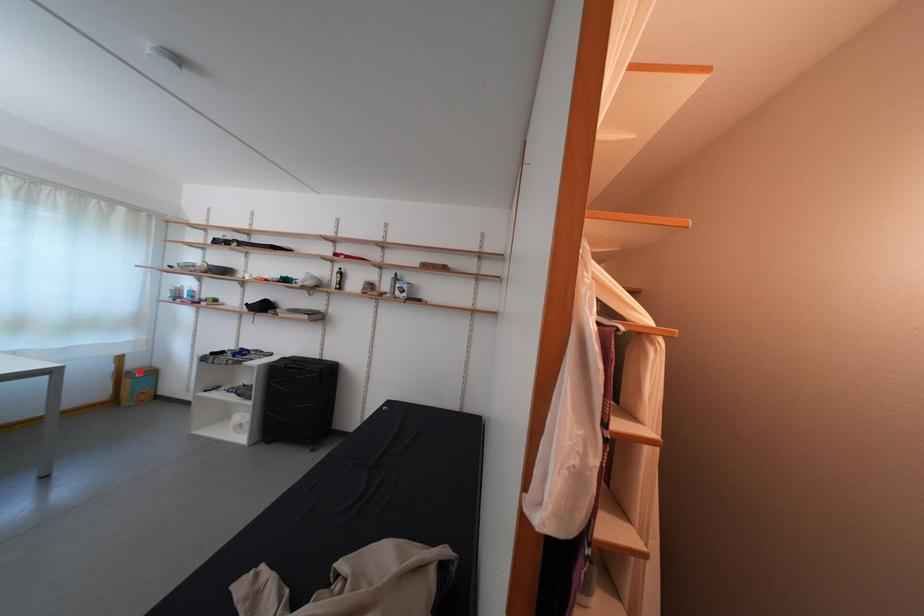
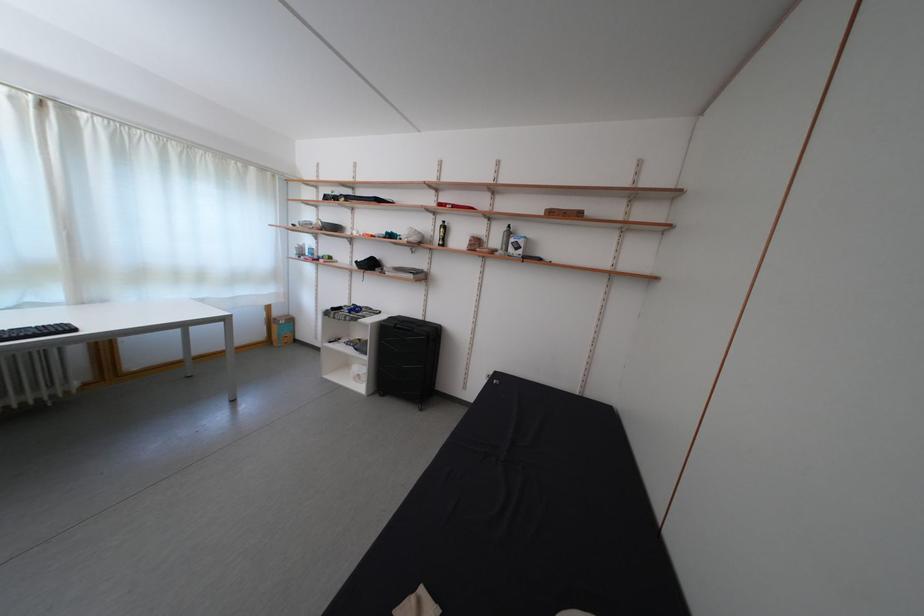
Question: I am providing you with two images of the same scene from different viewpoints. In image1, a red point is highlighted. Considering the same 3D point in image2, which of the following is correct?

Choices:
 (A) It is closer
 (B) It is farther

Answer: (B)